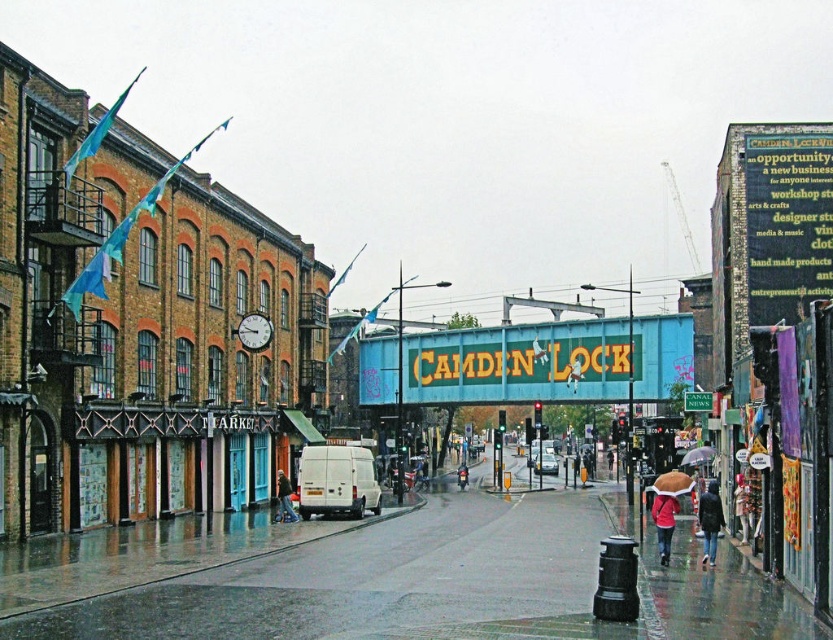
Question: Is teal painted metal signboard at center closer to the viewer compared to dark gray fabric umbrella at lower right?

Choices:
 (A) no
 (B) yes

Answer: (A)

Question: Does red matte jacket at lower right appear on the left side of denim jacket at lower left?

Choices:
 (A) yes
 (B) no

Answer: (B)

Question: Which point is closer to the camera?

Choices:
 (A) dark gray fabric umbrella at lower right
 (B) glossy concrete pavement at lower center

Answer: (B)

Question: Among these points, which one is farthest from the camera?

Choices:
 (A) (667, 538)
 (B) (113, 600)

Answer: (A)

Question: Does teal painted metal signboard at center have a larger size compared to denim jacket at lower left?

Choices:
 (A) no
 (B) yes

Answer: (B)

Question: Which of the following is the farthest from the observer?

Choices:
 (A) dark gray fabric umbrella at lower right
 (B) red matte jacket at lower right
 (C) teal painted metal signboard at center
 (D) red jacket at center

Answer: (D)